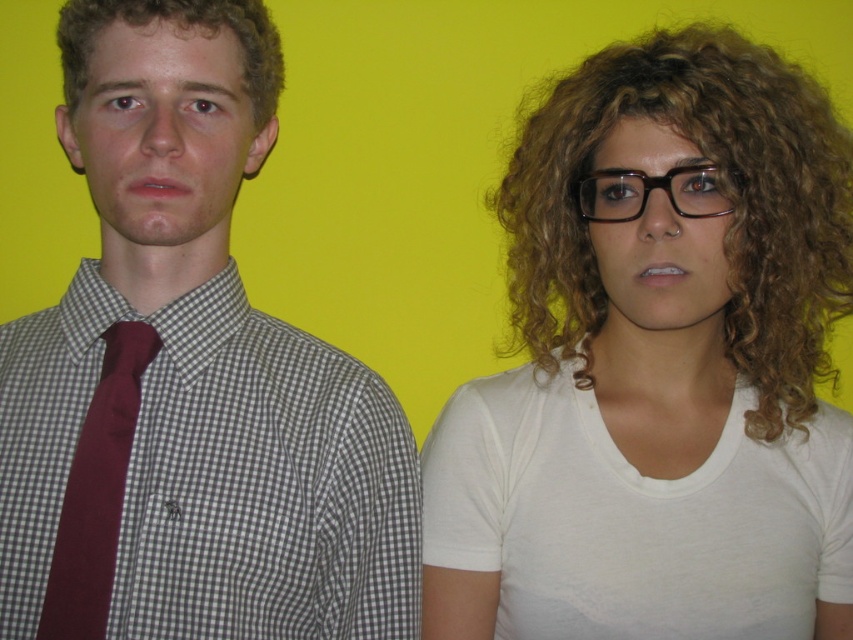
You are standing in front of the two people in the image. Which of the two points, point (671, 104) or point (697, 172), is closer to you?

Point (697, 172) is closer to you because it is in front of point (671, 104).

You are a photographer trying to adjust the lighting for a portrait. You notice the curly blonde hair at right and the black plastic glasses at center in the frame. Which object should you focus on first if you want to ensure the taller one is properly lit?

The curly blonde hair at right is taller than the black plastic glasses at center, so you should focus on the curly blonde hair at right first to ensure proper lighting.

You are a photographer trying to adjust the lighting for a group photo. You notice the curly blonde hair at right and the maroon fabric tie at left. Which object is positioned higher in the frame?

The curly blonde hair at right is located above the maroon fabric tie at left, so it is positioned higher in the frame.